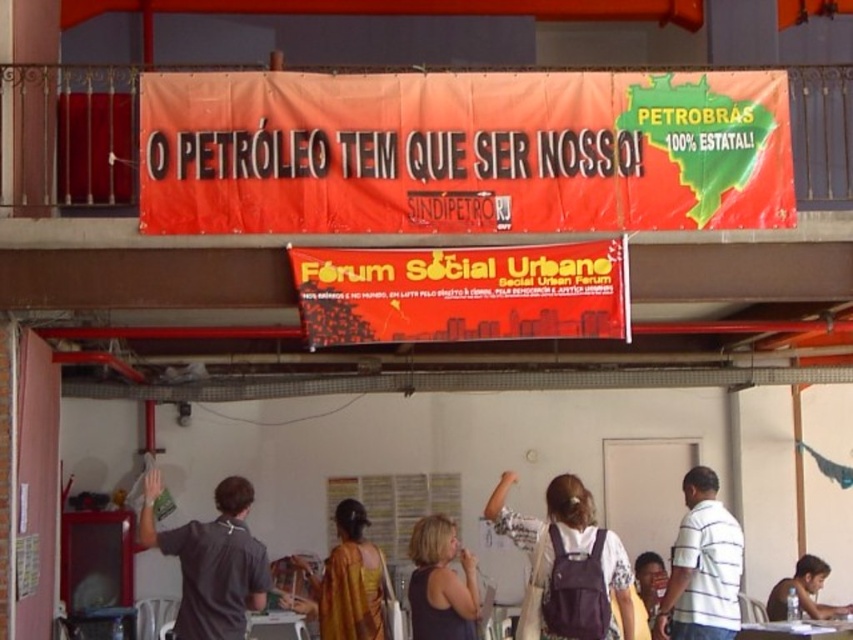
Question: Does white striped shirt at center come behind smooth brown shirt at lower right?

Choices:
 (A) no
 (B) yes

Answer: (A)

Question: Which object is positioned closest to the white fabric backpack at center?

Choices:
 (A) smooth brown shirt at lower right
 (B) yellow fabric dress at center

Answer: (B)

Question: Can you confirm if smooth brown shirt at lower right is positioned above dark skin face at lower right?

Choices:
 (A) no
 (B) yes

Answer: (A)

Question: Considering the real-world distances, which object is closest to the smooth brown shirt at lower right?

Choices:
 (A) dark gray shirt at upper left
 (B) white fabric backpack at center
 (C) dark gray tank top at center

Answer: (C)

Question: Does dark gray shirt at upper left appear on the right side of yellow fabric dress at center?

Choices:
 (A) yes
 (B) no

Answer: (B)

Question: Which point is farther from the camera taking this photo?

Choices:
 (A) (651, 604)
 (B) (352, 586)

Answer: (A)